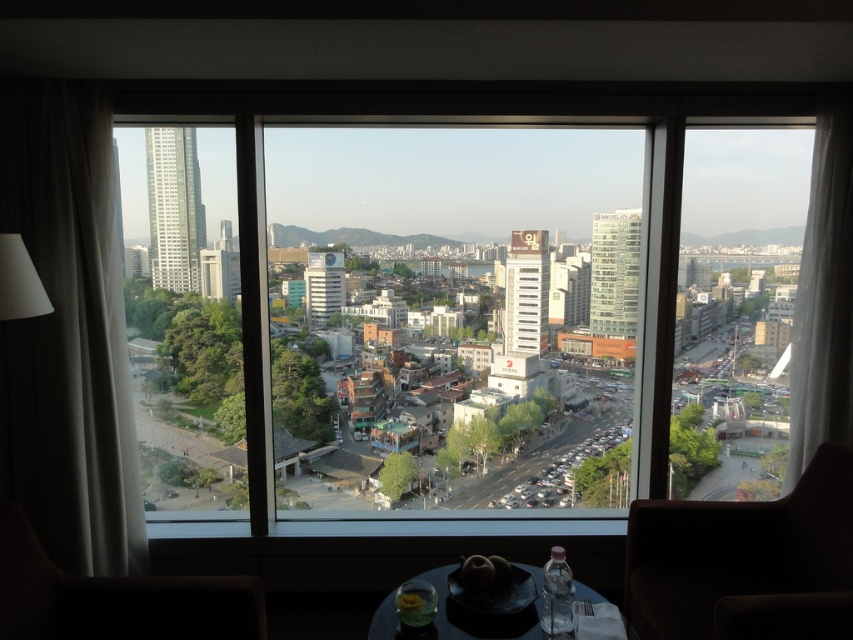
Looking at this image, you are planning to place a new sofa in the room. The sofa is as large as the white glass building at center. Based on the scene, can the brown leather armchair at lower right be moved to accommodate the sofa?

The brown leather armchair at lower right occupies less space than the white glass building at center. Since the sofa is as large as the white glass building at center, the brown leather armchair at lower right would need to be moved to accommodate the sofa due to its smaller size.

You are sitting in the dark brown leather armchair at lower left and want to reach the matte black table at lower center. Is the table within arm s length?

The dark brown leather armchair at lower left is closer to the viewer than the matte black table at lower center, so the table is farther away and not within arm s length.

You are standing in a room with a table and looking out through the large windows. You see a white glass skyscraper at left and a transparent glass building at right. Which building is closer to you?

The white glass skyscraper at left is closer to you because it is positioned over the transparent glass building at right, indicating it is in front.